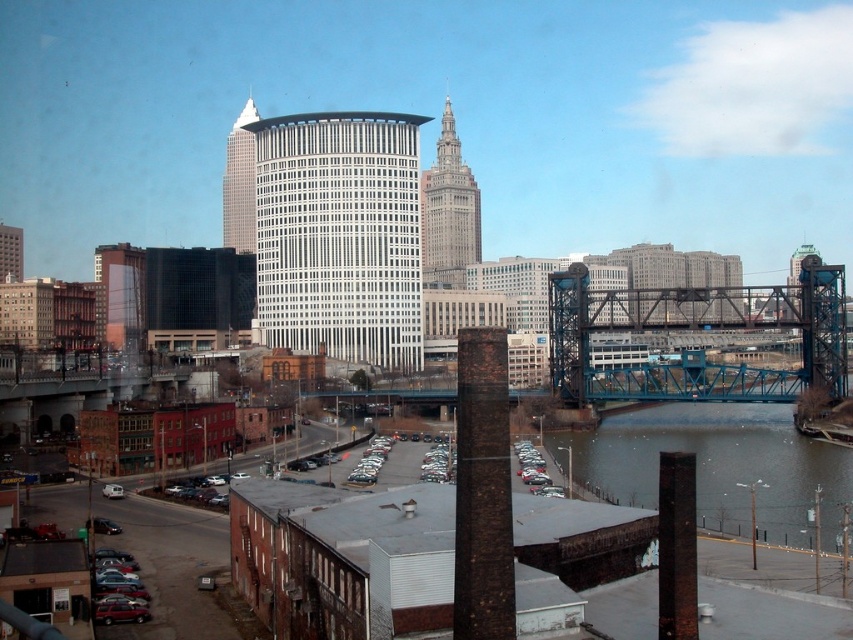
You are standing at the point marked by the coordinates point (717,467) in the image. What is the closest object to you?

The closest object to you is the dark gray concrete waterway at lower right represented by point (717,467).

You are standing in the parking lot and want to take a photo of the blue metallic bridge at right and the white glass skyscraper at upper center. Which object should you focus on first to ensure both are in the frame?

You should focus on the blue metallic bridge at right first because it is closer to the viewer than the white glass skyscraper at upper center, ensuring both are in the frame.